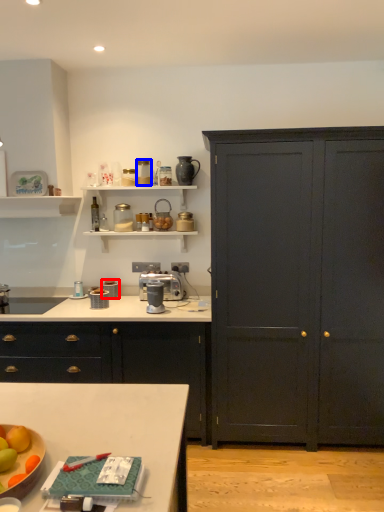
Question: Which of the following is the closest to the observer, appliance (highlighted by a red box) or appliance (highlighted by a blue box)?

Choices:
 (A) appliance
 (B) appliance

Answer: (B)